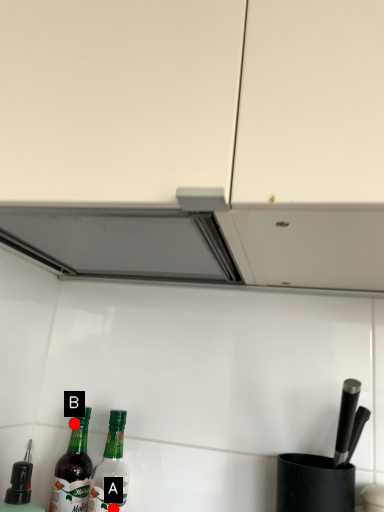
Question: Two points are circled on the image, labeled by A and B beside each circle. Which point appears farthest from the camera in this image?

Choices:
 (A) A is further
 (B) B is further

Answer: (B)